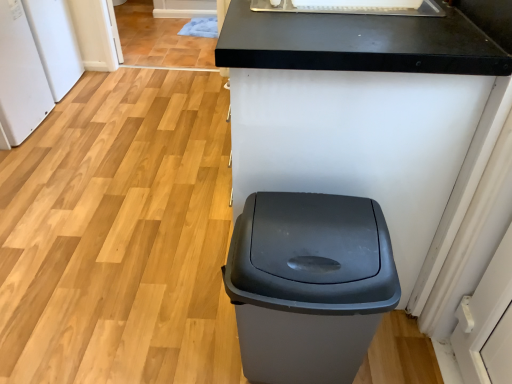
Question: From the image's perspective, does matte gray plastic trash can at center appear higher than white glossy sink at upper center?

Choices:
 (A) yes
 (B) no

Answer: (B)

Question: Could you tell me if matte gray plastic trash can at center is facing white glossy sink at upper center?

Choices:
 (A) no
 (B) yes

Answer: (A)

Question: Can you confirm if matte gray plastic trash can at center is thinner than white glossy sink at upper center?

Choices:
 (A) yes
 (B) no

Answer: (A)

Question: Considering the relative positions of matte gray plastic trash can at center and white glossy sink at upper center in the image provided, is matte gray plastic trash can at center to the right of white glossy sink at upper center from the viewer's perspective?

Choices:
 (A) yes
 (B) no

Answer: (B)

Question: Can you confirm if matte gray plastic trash can at center is taller than white glossy sink at upper center?

Choices:
 (A) yes
 (B) no

Answer: (A)

Question: Is point (396, 9) positioned closer to the camera than point (338, 44)?

Choices:
 (A) closer
 (B) farther

Answer: (B)

Question: From the image's perspective, is white glossy sink at upper center located above or below black matte counter at center?

Choices:
 (A) above
 (B) below

Answer: (A)

Question: From a real-world perspective, relative to black matte counter at center, is white glossy sink at upper center vertically above or below?

Choices:
 (A) below
 (B) above

Answer: (B)

Question: Based on their positions, is white glossy sink at upper center located to the left or right of black matte counter at center?

Choices:
 (A) left
 (B) right

Answer: (B)

Question: Does point (53, 77) appear closer or farther from the camera than point (479, 104)?

Choices:
 (A) closer
 (B) farther

Answer: (B)

Question: Is white matte refrigerator at left, which ranks as the 2th appliance in front-to-back order, taller or shorter than black matte counter at center?

Choices:
 (A) tall
 (B) short

Answer: (B)

Question: Based on their positions, is white matte refrigerator at left, which appears as the first appliance when viewed from the back, located to the left or right of black matte counter at center?

Choices:
 (A) right
 (B) left

Answer: (B)

Question: Would you say white matte refrigerator at left, which appears as the first appliance when viewed from the back, is inside or outside black matte counter at center?

Choices:
 (A) outside
 (B) inside

Answer: (A)

Question: From a real-world perspective, is matte gray plastic trash can at center physically located above or below white matte refrigerator at left, arranged as the first appliance when viewed from the front?

Choices:
 (A) below
 (B) above

Answer: (A)

Question: Considering the positions of matte gray plastic trash can at center and white matte refrigerator at left, acting as the 2th appliance starting from the back, in the image, is matte gray plastic trash can at center taller or shorter than white matte refrigerator at left, acting as the 2th appliance starting from the back,?

Choices:
 (A) tall
 (B) short

Answer: (B)